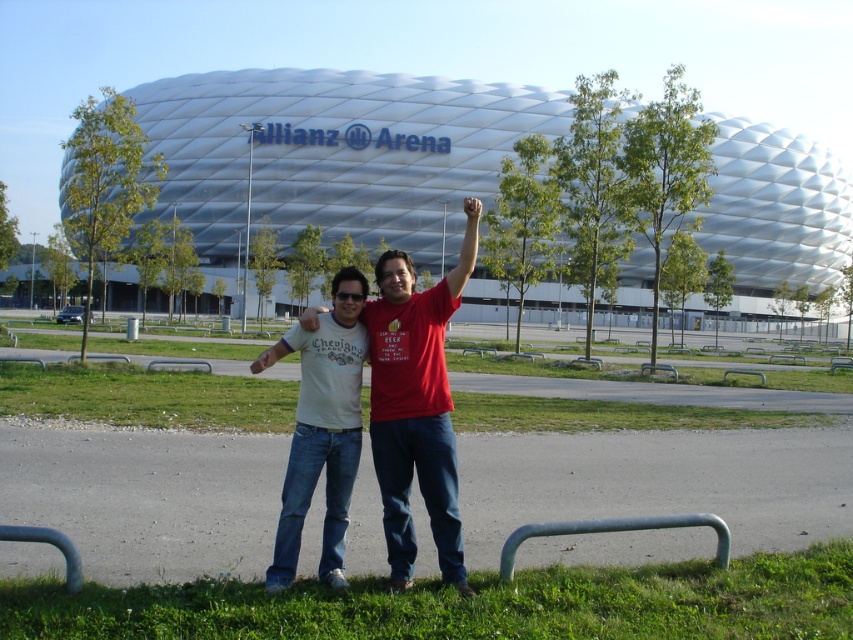
You are standing in front of the Allianz Arena and want to take a photo of two points marked on the stadium wall. The first point is at coordinates point (405,259) and the second is at point (341,365). Which point is closer to you when you are facing the stadium?

Point (405,259) is closer to you because it is further to the viewer than point (341,365).